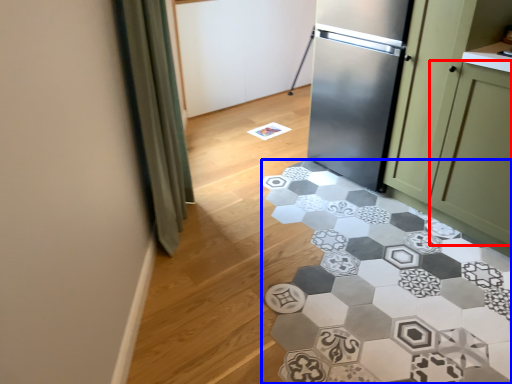
Question: Which of the following is the farthest to the observer, glass door (highlighted by a red box) or marble (highlighted by a blue box)?

Choices:
 (A) glass door
 (B) marble

Answer: (A)